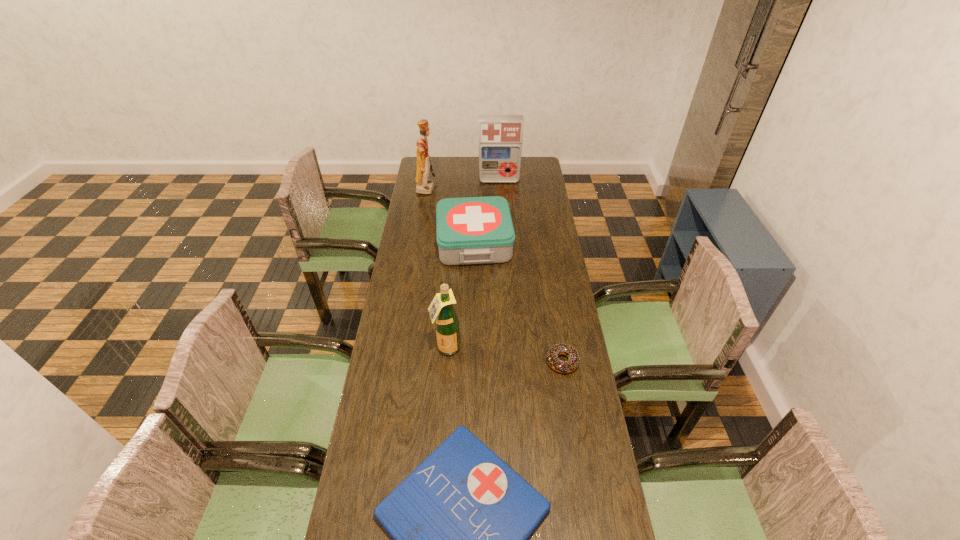
Where is `free spot that satisfies the following two spatial constraints: 1. on the back side of the fourth nearest object; 2. on the front-facing side of the nutcracker`? The image size is (960, 540). free spot that satisfies the following two spatial constraints: 1. on the back side of the fourth nearest object; 2. on the front-facing side of the nutcracker is located at coordinates (475, 188).